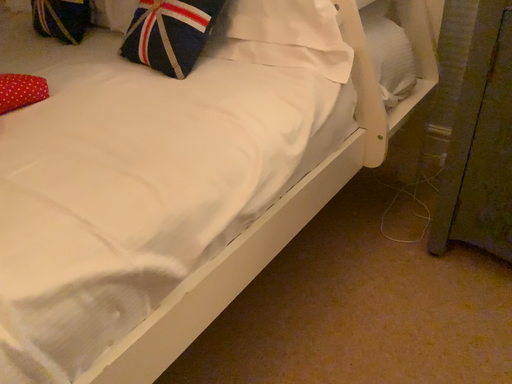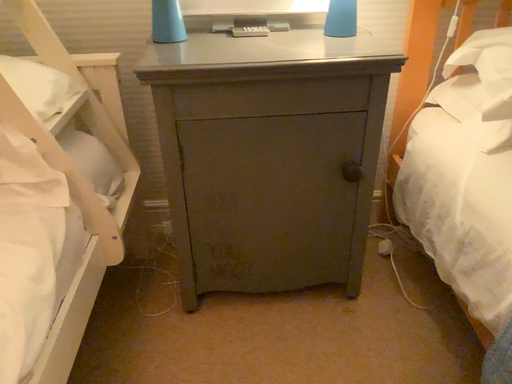
Question: How did the camera likely rotate when shooting the video?

Choices:
 (A) rotated left
 (B) rotated right

Answer: (B)